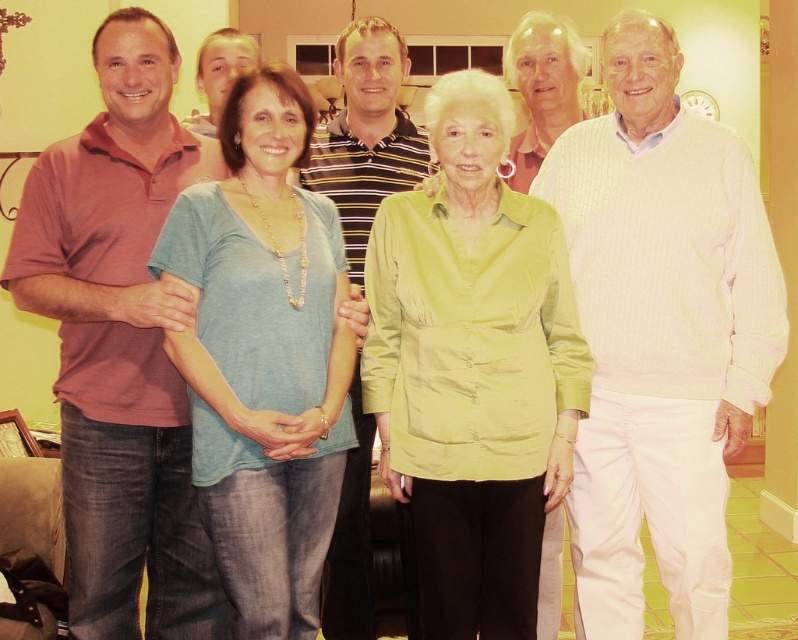
Question: Is matte red polo shirt at left smaller than striped polo shirt at center?

Choices:
 (A) yes
 (B) no

Answer: (B)

Question: Does matte red polo shirt at left have a greater width compared to striped polo shirt at center?

Choices:
 (A) yes
 (B) no

Answer: (A)

Question: Which object appears farthest from the camera in this image?

Choices:
 (A) white ribbed sweater at right
 (B) matte red polo shirt at left
 (C) light blue t-shirt at center
 (D) matte green blouse at center

Answer: (A)

Question: Based on their relative distances, which object is nearer to the matte green blouse at center?

Choices:
 (A) white ribbed sweater at right
 (B) matte red polo shirt at left
 (C) striped polo shirt at center

Answer: (A)

Question: Is light blue t-shirt at center further to the viewer compared to white textured sweater at upper center?

Choices:
 (A) no
 (B) yes

Answer: (A)

Question: Considering the real-world distances, which object is closest to the white textured sweater at upper center?

Choices:
 (A) light blue t-shirt at center
 (B) matte red polo shirt at left
 (C) white ribbed sweater at right

Answer: (C)